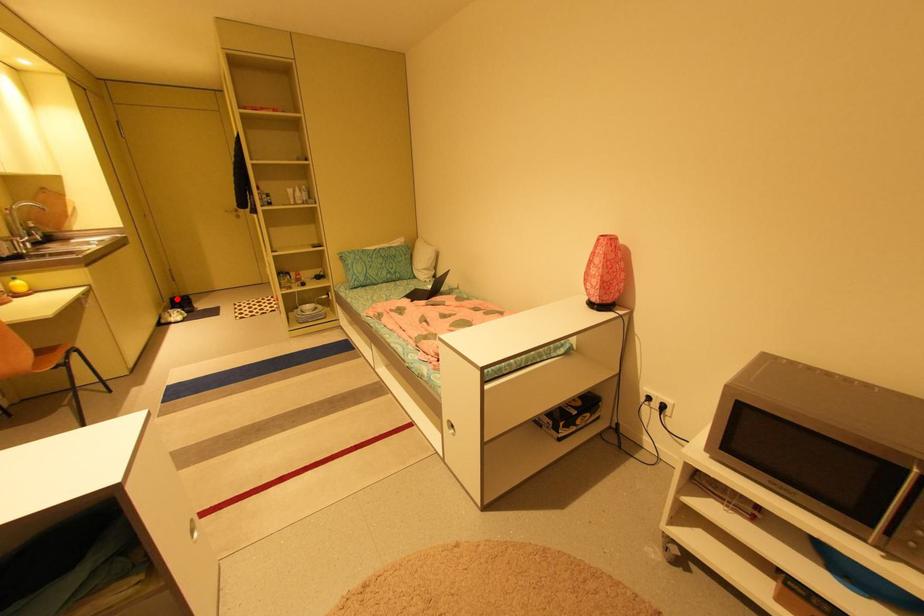
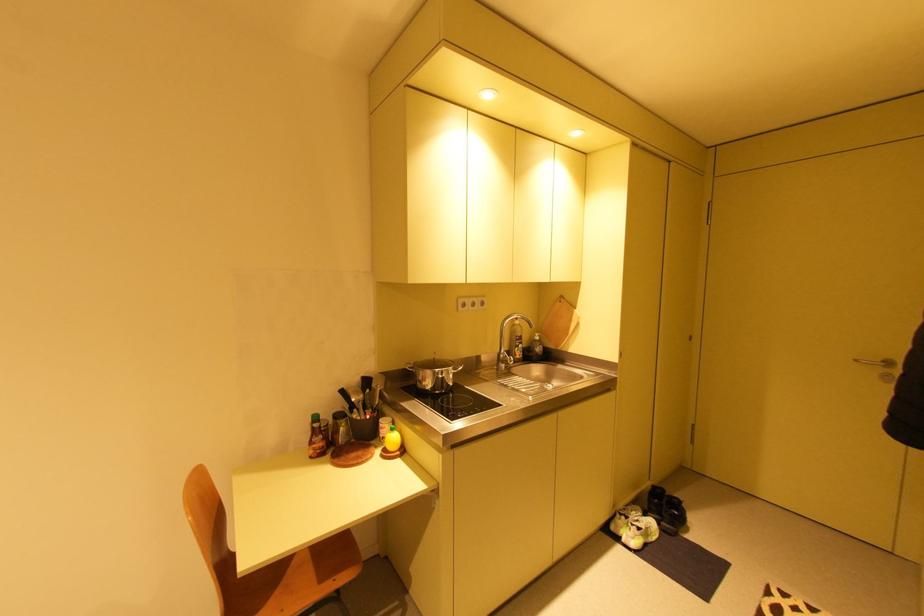
Question: A red point is marked in image1. In image2, is the corresponding 3D point closer to the camera or farther? Reply with the corresponding letter.

Choices:
 (A) The corresponding 3D point is closer.
 (B) The corresponding 3D point is farther.

Answer: (A)